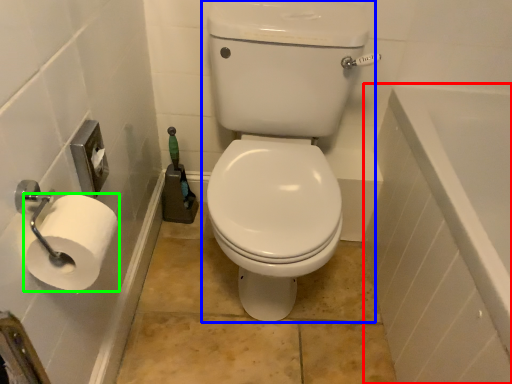
Question: Based on their relative distances, which object is nearer to bath (highlighted by a red box)? Choose from sit (highlighted by a blue box) and toilet paper (highlighted by a green box).

Choices:
 (A) sit
 (B) toilet paper

Answer: (A)